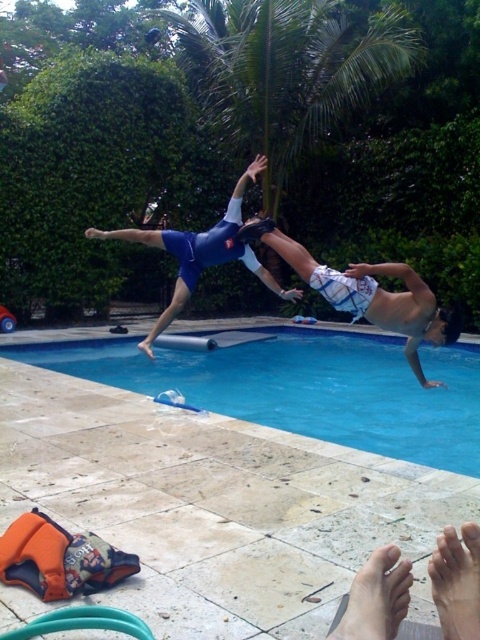
In order to click on blue smooth water at center in this screenshot , I will do `click(304, 387)`.

Who is shorter, blue smooth water at center or white cotton shorts at center?

Standing shorter between the two is blue smooth water at center.

Identify the location of blue smooth water at center. Image resolution: width=480 pixels, height=640 pixels. coord(304,387).

Which is more to the right, blue smooth water at center or blue matte swimsuit at center?

From the viewer's perspective, blue smooth water at center appears more on the right side.

Does blue smooth water at center appear on the left side of blue matte swimsuit at center?

Incorrect, blue smooth water at center is not on the left side of blue matte swimsuit at center.

Between point (437, 364) and point (267, 275), which one is positioned in front?

Positioned in front is point (267, 275).

This screenshot has height=640, width=480. Find the location of `blue smooth water at center`. blue smooth water at center is located at coordinates (304, 387).

Who is more distant from viewer, (x=342, y=280) or (x=158, y=237)?

The point (x=158, y=237) is more distant.

Is the position of white cotton shorts at center less distant than that of blue matte swimsuit at center?

Yes, it is.

Is point (322, 294) behind point (176, 292)?

No.

Locate an element on the screen. white cotton shorts at center is located at coordinates (x=368, y=292).